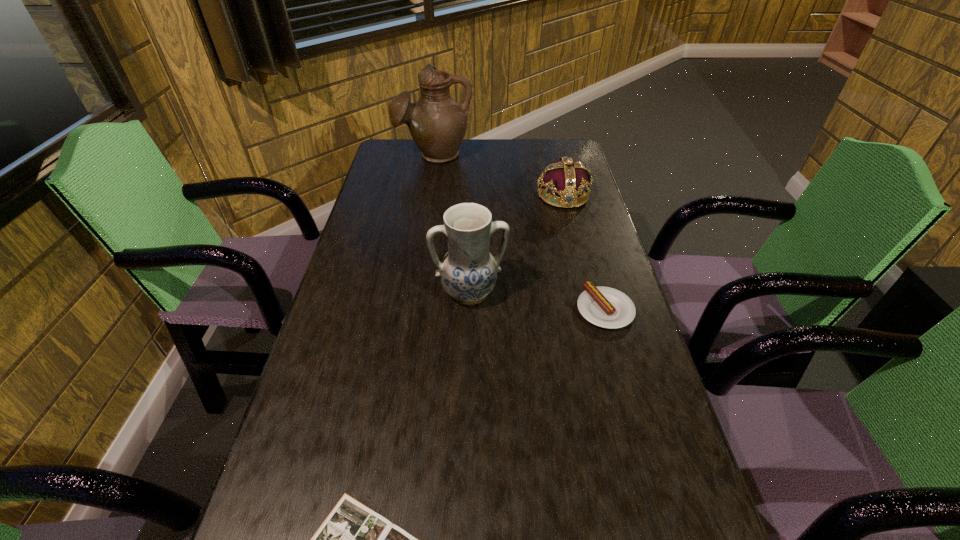
You are a GUI agent. You are given a task and a screenshot of the screen. Output one action in this format:
    pyautogui.click(x=<x>, y=<y>)
    Task: Click on the vacant area that lies between the third tallest object and the second shortest object
    This screenshot has width=960, height=540.
    Given the screenshot: What is the action you would take?
    pyautogui.click(x=584, y=253)

The image size is (960, 540). What are the coordinates of `vacant space that is in between the sausage and the pottery` in the screenshot? It's located at (538, 301).

This screenshot has height=540, width=960. I want to click on free space between the fourth tallest object and the pottery, so click(x=538, y=301).

Select which object appears as the third closest to the book. Please provide its 2D coordinates. Your answer should be formatted as a tuple, i.e. [(x, y)], where the tuple contains the x and y coordinates of a point satisfying the conditions above.

[(566, 178)]

At what (x,y) coordinates should I click in order to perform the action: click on object identified as the closest to the pottery. Please return your answer as a coordinate pair (x, y). This screenshot has width=960, height=540. Looking at the image, I should click on (606, 307).

Find the location of a particular element. vacant space that satisfies the following two spatial constraints: 1. at the spout of the pottery; 2. on the left side of the farthest object is located at coordinates (413, 293).